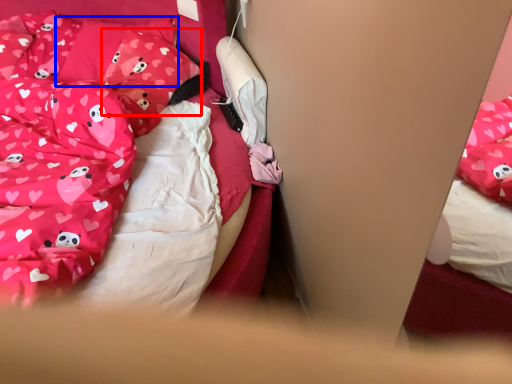
Question: Among these objects, which one is nearest to the camera, pillow (highlighted by a red box) or pillow (highlighted by a blue box)?

Choices:
 (A) pillow
 (B) pillow

Answer: (A)